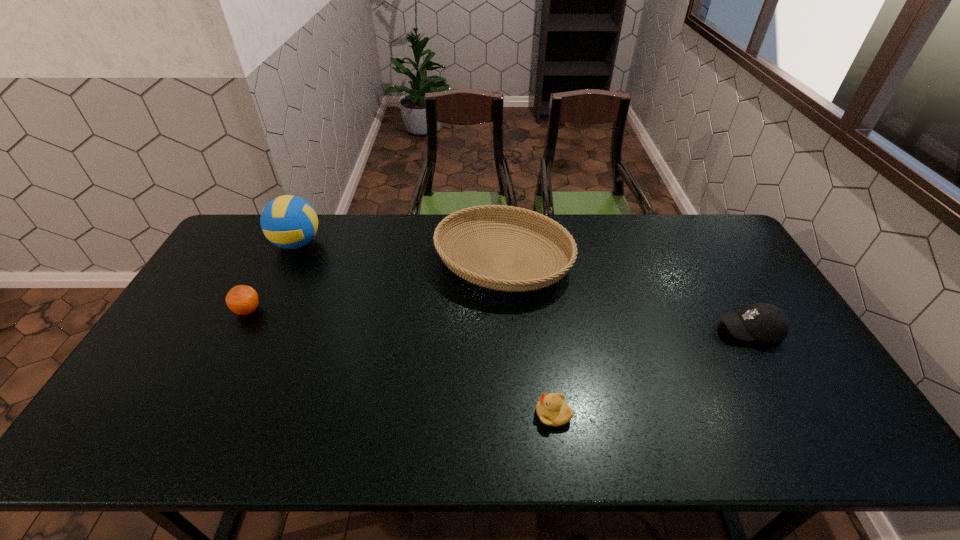
Where is `free space located 0.060m on the front-facing side of the baseball cap`? free space located 0.060m on the front-facing side of the baseball cap is located at coordinates (696, 330).

Where is `vacant space located 0.250m on the front-facing side of the baseball cap`? vacant space located 0.250m on the front-facing side of the baseball cap is located at coordinates (629, 330).

The width and height of the screenshot is (960, 540). In order to click on vacant space situated on the beak of the nearest object in this screenshot , I will do `click(428, 414)`.

You are a GUI agent. You are given a task and a screenshot of the screen. Output one action in this format:
    pyautogui.click(x=<x>, y=<y>)
    Task: Click on the vacant space located on the beak of the nearest object
    
    Given the screenshot: What is the action you would take?
    pyautogui.click(x=462, y=414)

Where is `free space located 0.290m on the beak of the nearest object`? Image resolution: width=960 pixels, height=540 pixels. free space located 0.290m on the beak of the nearest object is located at coordinates (416, 414).

This screenshot has height=540, width=960. Find the location of `volleyball that is at the far edge`. volleyball that is at the far edge is located at coordinates (290, 222).

Locate an element on the screen. The image size is (960, 540). basket situated at the far edge is located at coordinates (493, 281).

Identify the location of object present at the near edge. The image size is (960, 540). pos(552,410).

The image size is (960, 540). Identify the location of volleyball that is at the left edge. (290, 222).

Where is `orange located in the left edge section of the desktop`? orange located in the left edge section of the desktop is located at coordinates (243, 300).